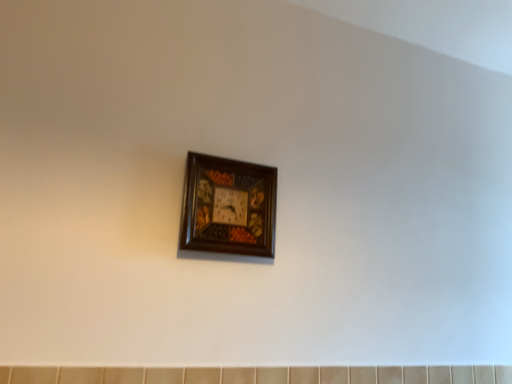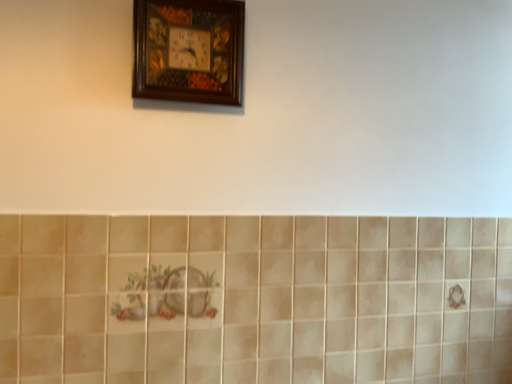
Question: Which way did the camera rotate in the video?

Choices:
 (A) rotated upward
 (B) rotated downward

Answer: (B)